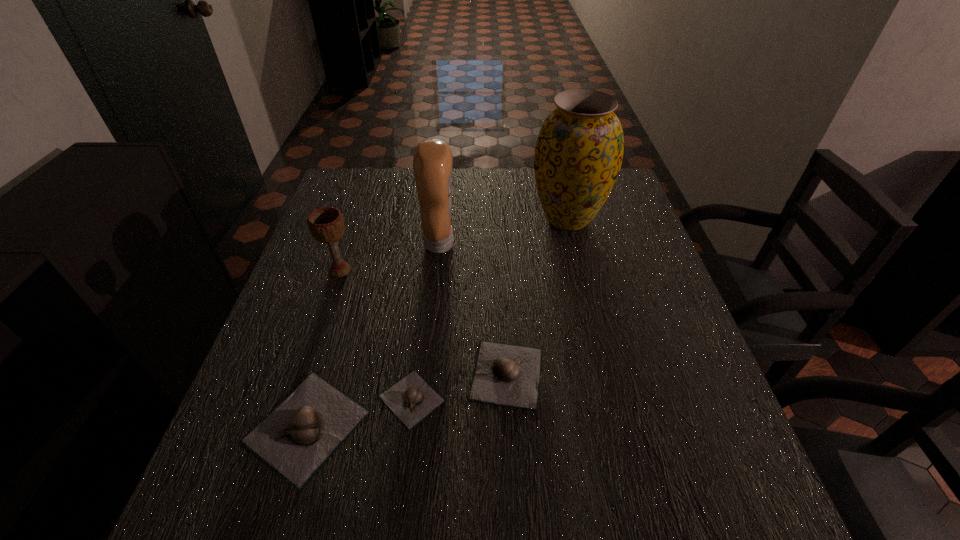
Please point a spot to add another garlic on the right. Please provide its 2D coordinates. Your answer should be formatted as a tuple, i.e. [(x, y)], where the tuple contains the x and y coordinates of a point satisfying the conditions above.

[(593, 350)]